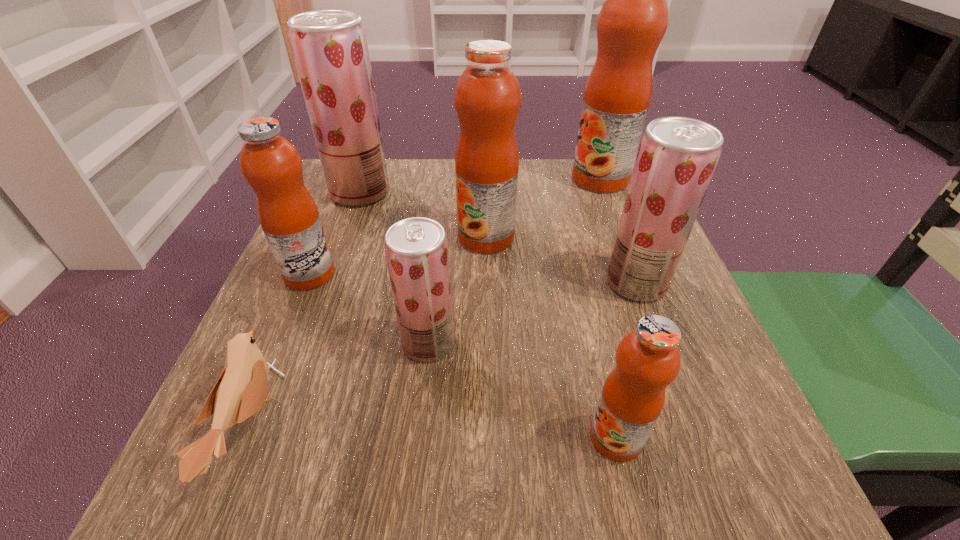
Find the location of `bird that is at the near edge`. bird that is at the near edge is located at coordinates (239, 393).

At what (x,y) coordinates should I click in order to perform the action: click on bird positioned at the left edge. Please return your answer as a coordinate pair (x, y). This screenshot has height=540, width=960. Looking at the image, I should click on (239, 393).

Where is `object located in the far left corner section of the desktop`? The width and height of the screenshot is (960, 540). object located in the far left corner section of the desktop is located at coordinates (330, 49).

Image resolution: width=960 pixels, height=540 pixels. Identify the location of object present at the near left corner. (239, 393).

Where is `object positioned at the far right corner`? object positioned at the far right corner is located at coordinates (633, 19).

Image resolution: width=960 pixels, height=540 pixels. What are the coordinates of `object that is at the near right corner` in the screenshot? It's located at (648, 359).

At what (x,y) coordinates should I click in order to perform the action: click on free space at the far edge. Please return your answer as a coordinate pair (x, y). The height and width of the screenshot is (540, 960). Looking at the image, I should click on (538, 159).

Identify the location of free space at the left edge of the desktop. (369, 266).

Find the location of `free space at the right edge of the desktop`. free space at the right edge of the desktop is located at coordinates [x=688, y=300].

Identify the location of vacant region at the near right corner of the desktop. This screenshot has height=540, width=960. (684, 511).